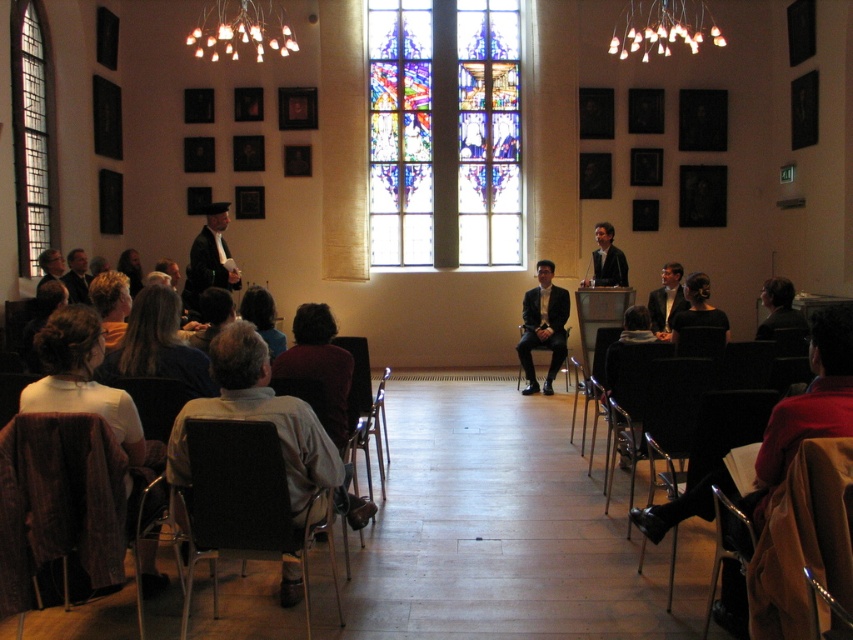
Does translucent glass chandelier at upper center have a smaller size compared to matte black suit at center?

Incorrect, translucent glass chandelier at upper center is not smaller in size than matte black suit at center.

Is point (618, 24) more distant than point (614, 260)?

Yes, it is.

Find the location of `translucent glass chandelier at upper center`. translucent glass chandelier at upper center is located at coordinates (662, 28).

Between stained glass window at center and dark brown hair at lower left, which one appears on the left side from the viewer's perspective?

dark brown hair at lower left

Is stained glass window at center to the left of dark brown hair at lower left from the viewer's perspective?

In fact, stained glass window at center is to the right of dark brown hair at lower left.

Who is more forward, (498,168) or (173,324)?

Point (173,324)

Where is `stained glass window at center`? Image resolution: width=853 pixels, height=640 pixels. stained glass window at center is located at coordinates (444, 132).

Who is more forward, (22,204) or (659,288)?

Point (22,204) is more forward.

Is stained glass window at left bigger than formal black suit at center?

Incorrect, stained glass window at left is not larger than formal black suit at center.

I want to click on stained glass window at left, so click(x=30, y=132).